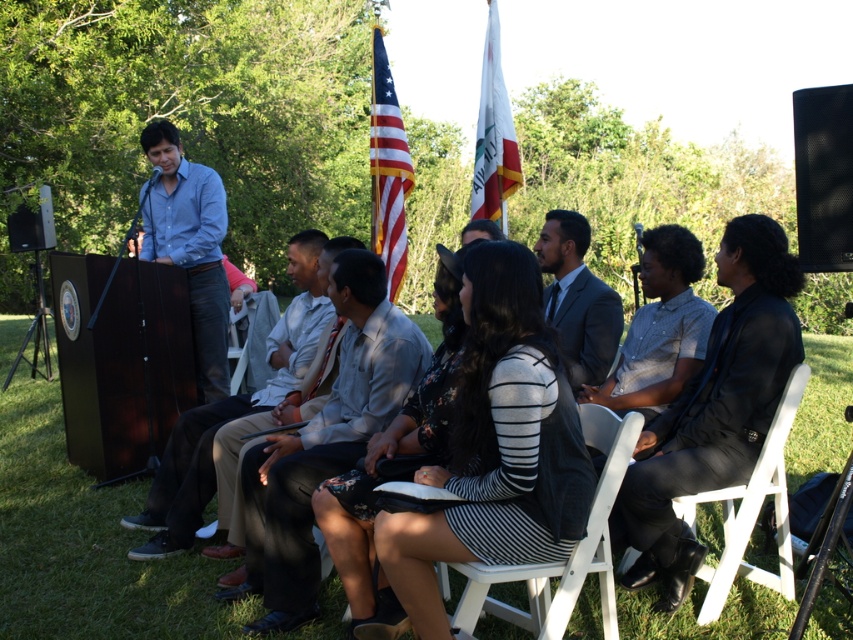
You are standing at the edge of the grassy area and want to locate the light brown pants at center. Which direction should you look to find them?

The light brown pants at center is located at point 0.645 on the x axis and 0.272 on the y axis, so you should look towards the center of the image to find them.

You are attending a park event and notice two items at the center of the scene. Which one is positioned to the right of the other? The items are the light brown pants at center and the dark gray fabric chair at center.

The light brown pants at center are to the right of the dark gray fabric chair at center.

You are attending a park event and notice two people sitting in the front row. One is wearing light brown pants at center and the other is wearing gray suit at center. Which person is sitting closer to the ground?

The light brown pants at center is located below gray suit at center, so the person wearing light brown pants at center is sitting closer to the ground.